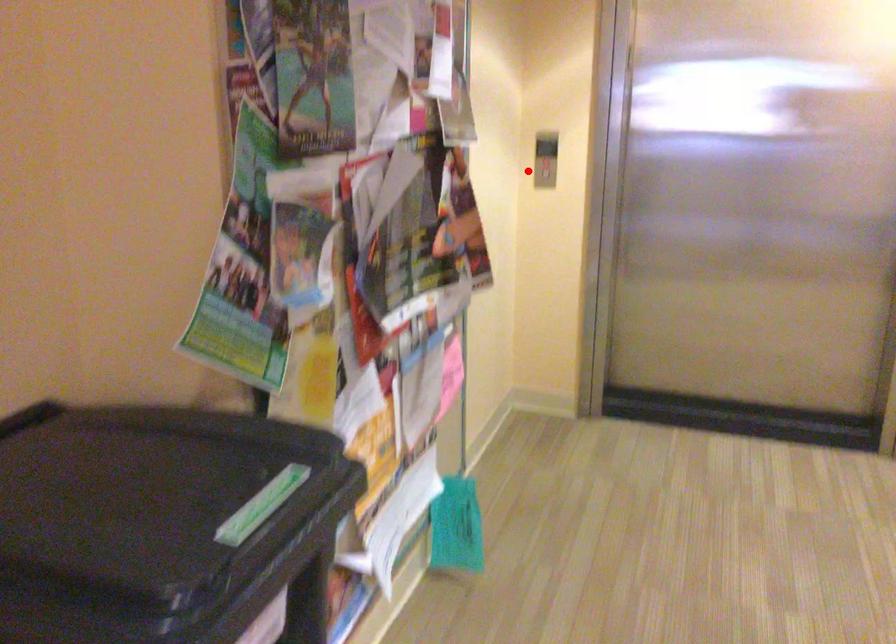
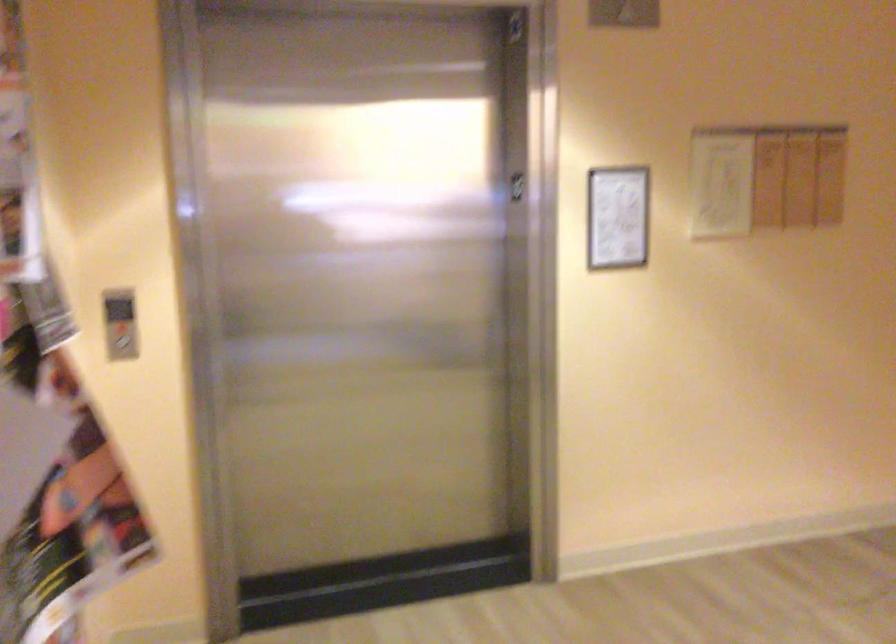
Question: I am providing you with two images of the same scene from different viewpoints. Image1 has a red point marked. In image2, the corresponding 3D location appears at what relative position? Reply with the corresponding letter.

Choices:
 (A) Closer
 (B) Farther

Answer: (A)